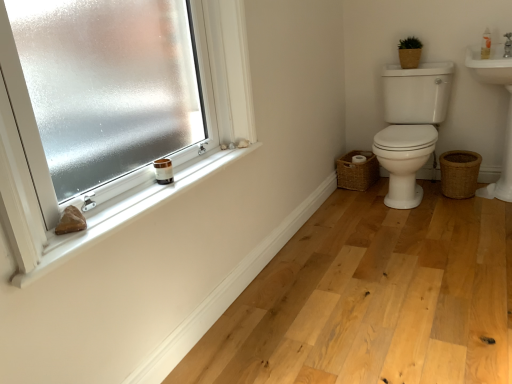
Question: Does white plastic bottle at upper right appear on the left side of natural wood floor at lower center?

Choices:
 (A) no
 (B) yes

Answer: (A)

Question: From a real-world perspective, is white plastic bottle at upper right below natural wood floor at lower center?

Choices:
 (A) no
 (B) yes

Answer: (A)

Question: Is there a large distance between white plastic bottle at upper right and natural wood floor at lower center?

Choices:
 (A) no
 (B) yes

Answer: (B)

Question: Is white plastic bottle at upper right oriented towards natural wood floor at lower center?

Choices:
 (A) yes
 (B) no

Answer: (B)

Question: Is natural wood floor at lower center surrounded by white plastic bottle at upper right?

Choices:
 (A) yes
 (B) no

Answer: (B)

Question: Is frosted glass window at upper left inside or outside of woven brown basket at lower right, which ranks as the 2th basket in top-to-bottom order?

Choices:
 (A) inside
 (B) outside

Answer: (B)

Question: From a real-world perspective, is frosted glass window at upper left above or below woven brown basket at lower right, which appears as the first basket when viewed from the left?

Choices:
 (A) below
 (B) above

Answer: (B)

Question: Is point (179, 33) positioned closer to the camera than point (360, 153)?

Choices:
 (A) closer
 (B) farther

Answer: (A)

Question: Visually, is frosted glass window at upper left positioned to the left or to the right of woven brown basket at lower right, marked as the third basket in a right-to-left arrangement?

Choices:
 (A) right
 (B) left

Answer: (B)

Question: From a real-world perspective, is white matte window sill at upper left physically located above or below brown woven basket at upper right, the 3th basket in the bottom-to-top sequence?

Choices:
 (A) below
 (B) above

Answer: (A)

Question: From the image's perspective, relative to brown woven basket at upper right, the 2th basket when ordered from right to left, is white matte window sill at upper left above or below?

Choices:
 (A) above
 (B) below

Answer: (B)

Question: Is point (111, 221) positioned closer to the camera than point (416, 51)?

Choices:
 (A) closer
 (B) farther

Answer: (A)

Question: Based on their sizes in the image, would you say white matte window sill at upper left is bigger or smaller than brown woven basket at upper right, the 3th basket in the bottom-to-top sequence?

Choices:
 (A) small
 (B) big

Answer: (B)

Question: Considering the positions of woven brown basket at lower right, acting as the 2th basket starting from the bottom, and natural wood floor at lower center in the image, is woven brown basket at lower right, acting as the 2th basket starting from the bottom, bigger or smaller than natural wood floor at lower center?

Choices:
 (A) small
 (B) big

Answer: (A)

Question: From the image's perspective, is woven brown basket at lower right, which ranks as the 2th basket in top-to-bottom order, above or below natural wood floor at lower center?

Choices:
 (A) below
 (B) above

Answer: (B)